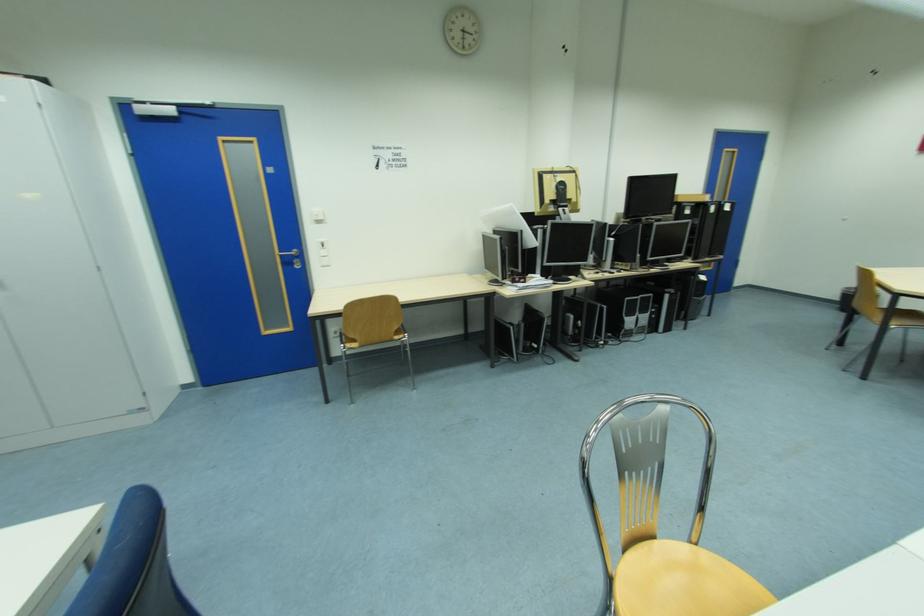
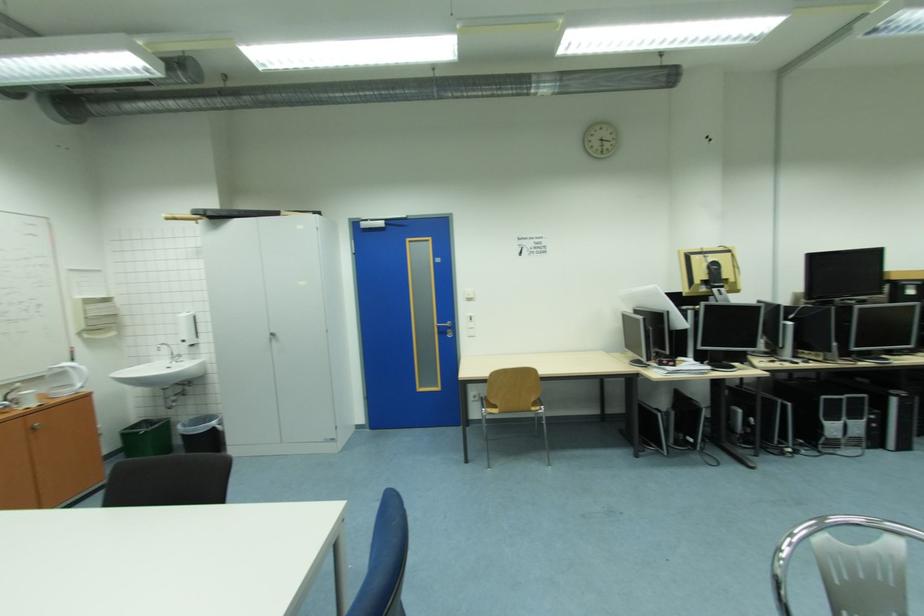
Find the pixel in the second image that matches (346,334) in the first image.

(483, 400)